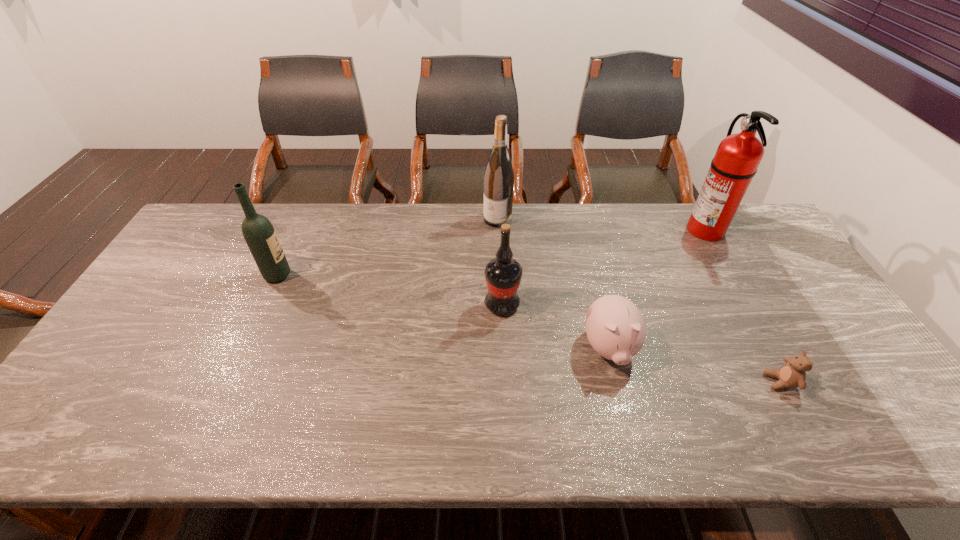
Where is `object that is at the right edge`? The height and width of the screenshot is (540, 960). object that is at the right edge is located at coordinates (738, 156).

Locate an element on the screen. object at the far right corner is located at coordinates [x=738, y=156].

In the image, there is a desktop. Where is `free region at the far edge`? free region at the far edge is located at coordinates (586, 240).

Where is `vacant region at the near edge`? vacant region at the near edge is located at coordinates (744, 430).

In the image, there is a desktop. Identify the location of vacant space at the right edge. (795, 310).

Identify the location of free space at the far left corner of the desktop. (209, 241).

Find the location of a particular element. The height and width of the screenshot is (540, 960). vacant point at the near right corner is located at coordinates (857, 448).

At what (x,y) coordinates should I click in order to perform the action: click on free space between the shortest object and the farthest wine bottle. Please return your answer as a coordinate pair (x, y). The width and height of the screenshot is (960, 540). Looking at the image, I should click on (639, 300).

This screenshot has width=960, height=540. In order to click on free point between the farthest wine bottle and the leftmost object in this screenshot , I will do `click(388, 247)`.

Locate an element on the screen. free spot between the second farthest wine bottle and the third nearest object is located at coordinates (390, 290).